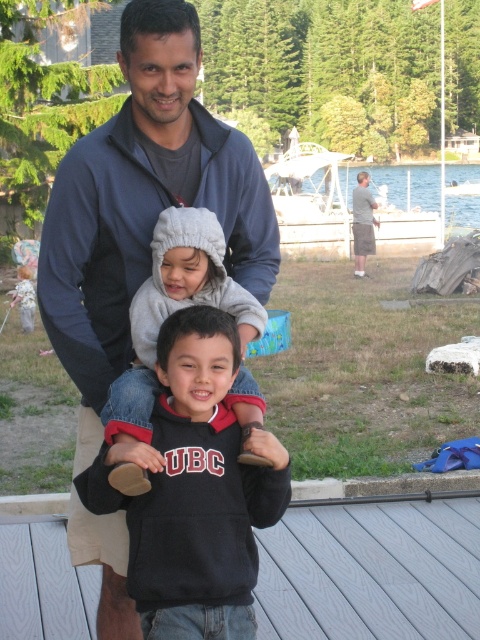
How far apart are gray wood deck at center and gray cotton shorts at right?

gray wood deck at center is 12.74 meters from gray cotton shorts at right.

Which is more to the right, gray wood deck at center or gray cotton shorts at right?

Positioned to the right is gray cotton shorts at right.

This screenshot has width=480, height=640. I want to click on gray wood deck at center, so click(372, 570).

Image resolution: width=480 pixels, height=640 pixels. In order to click on gray wood deck at center in this screenshot , I will do `click(372, 570)`.

Between point (90, 445) and point (193, 320), which one is positioned behind?

Positioned behind is point (90, 445).

Between dark blue fleece jacket at center and black fleece sweatshirt at center, which one appears on the right side from the viewer's perspective?

From the viewer's perspective, black fleece sweatshirt at center appears more on the right side.

Which is behind, point (160, 76) or point (152, 600)?

The point (160, 76) is more distant.

Find the location of a particular element. This screenshot has height=640, width=480. dark blue fleece jacket at center is located at coordinates (143, 204).

Is point (277, 518) farther from camera compared to point (202, 220)?

No.

Does black fleece sweatshirt at center have a smaller size compared to gray fleece hoodie at center?

Yes.

Is point (224, 346) in front of point (115, 426)?

No, (224, 346) is further to viewer.

Identify the location of black fleece sweatshirt at center. The height and width of the screenshot is (640, 480). (195, 484).